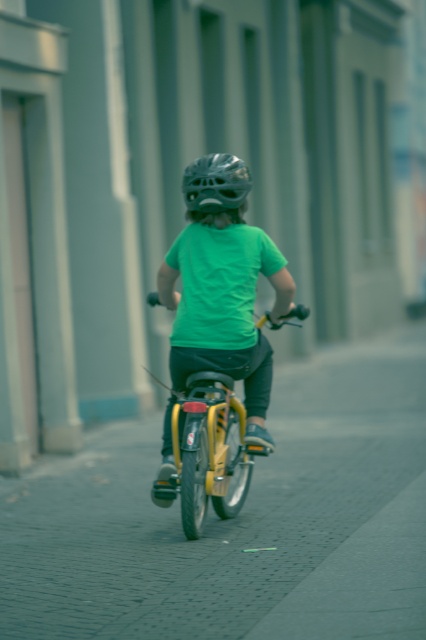
Based on the photo, you are standing at the point with coordinates point (241, 160) and want to move towards the point with coordinates point (267, 316). Given the scene described, is the path between these two points clear of obstacles?

The path between point (241, 160) and point (267, 316) is clear because the scene shows a narrow street with the child riding a bicycle, but there are no objects blocking the path between these two points as described.

You are a delivery person who needs to ride a bike through the narrow street shown. The cobblestone pavement at center and the yellow matte bicycle at center are in your path. Which object should you avoid hitting by steering to the left?

You should steer to the left to avoid hitting the cobblestone pavement at center, which is on the right side of the yellow matte bicycle at center.

You are a delivery person trying to navigate a narrow street. You see the cobblestone pavement at center and the shiny metallic helmet at center. Which object is located to the right of the other?

The cobblestone pavement at center is positioned on the right side of shiny metallic helmet at center, so the cobblestone pavement at center is to the right of the shiny metallic helmet at center.